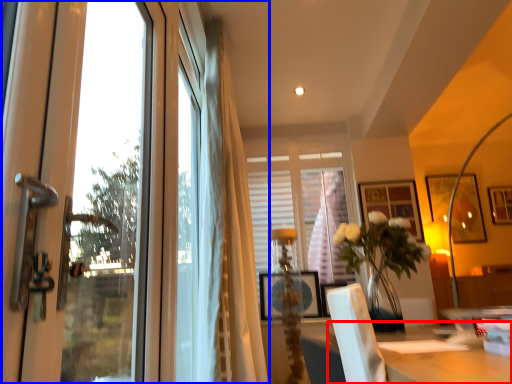
Question: Which point is closer to the camera, table (highlighted by a red box) or window (highlighted by a blue box)?

Choices:
 (A) table
 (B) window

Answer: (A)